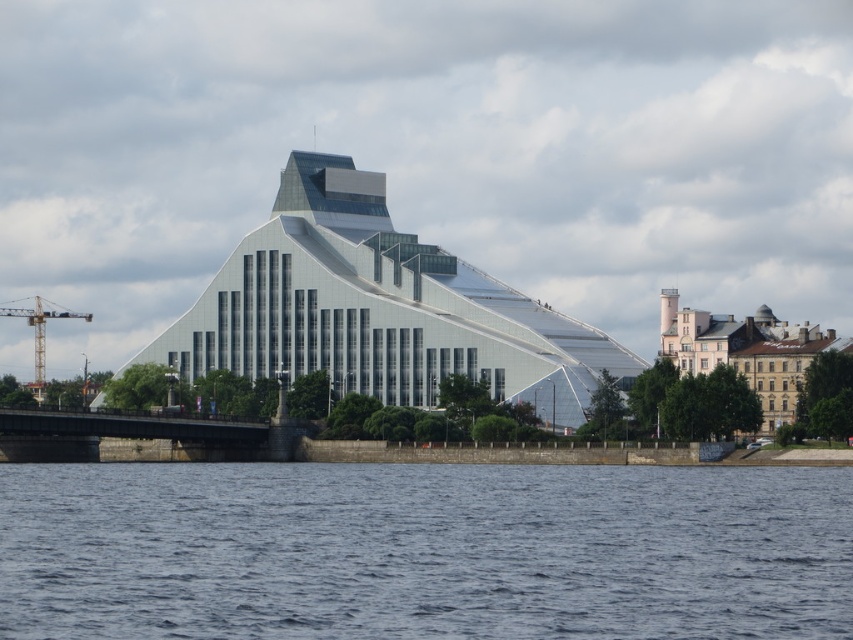
Where is `brown stone building at right`? The height and width of the screenshot is (640, 853). brown stone building at right is located at coordinates (746, 352).

Does brown stone building at right have a greater width compared to yellow metallic crane at left?

No, brown stone building at right is not wider than yellow metallic crane at left.

Who is more distant from viewer, (689, 339) or (41, 346)?

The point (41, 346) is behind.

This screenshot has width=853, height=640. Identify the location of brown stone building at right. (746, 352).

Does transparent glass building at center appear over yellow metallic crane at left?

Correct, transparent glass building at center is located above yellow metallic crane at left.

Between transparent glass building at center and yellow metallic crane at left, which one appears on the right side from the viewer's perspective?

transparent glass building at center is more to the right.

Is point (505, 388) less distant than point (38, 314)?

That is True.

Locate an element on the screen. Image resolution: width=853 pixels, height=640 pixels. transparent glass building at center is located at coordinates (378, 308).

Is point (376, 465) positioned before point (39, 340)?

Yes, it is.

Is blue water at lower center bigger than yellow metallic crane at left?

Yes.

Does point (370, 500) come farther from viewer compared to point (38, 392)?

No, (370, 500) is closer to viewer.

At what (x,y) coordinates should I click in order to perform the action: click on blue water at lower center. Please return your answer as a coordinate pair (x, y). The height and width of the screenshot is (640, 853). Looking at the image, I should click on (422, 550).